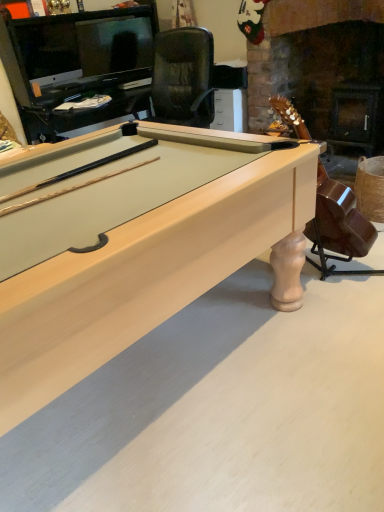
Identify the location of vacant region in front of matte brown guitar at center-right. The height and width of the screenshot is (512, 384). (328, 326).